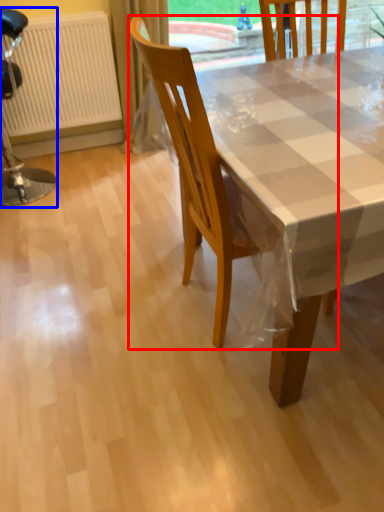
Question: Among these objects, which one is farthest to the camera, chair (highlighted by a red box) or chair (highlighted by a blue box)?

Choices:
 (A) chair
 (B) chair

Answer: (B)